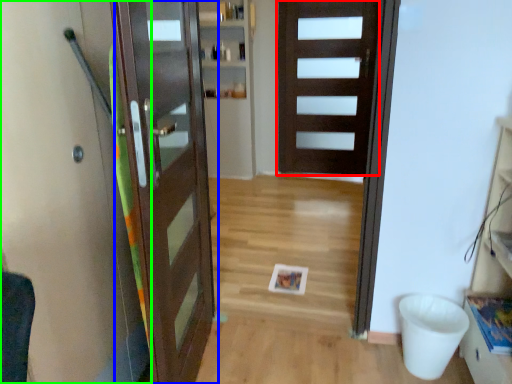
Question: Based on their relative distances, which object is farther from door (highlighted by a red box)? Choose from door (highlighted by a blue box) and elevator (highlighted by a green box).

Choices:
 (A) door
 (B) elevator

Answer: (B)